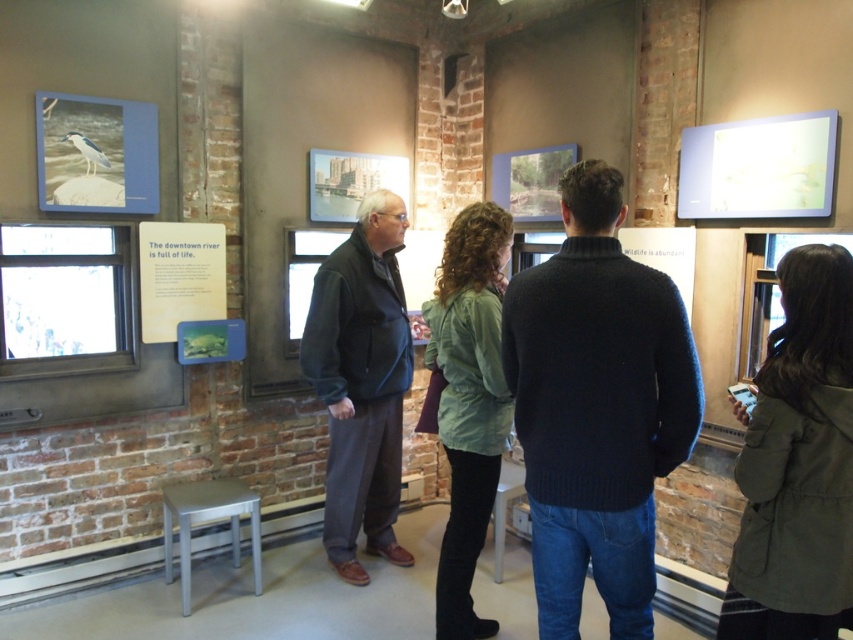
Is the position of green matte jacket at lower right more distant than that of white plastic stool at lower center?

No, green matte jacket at lower right is in front of white plastic stool at lower center.

Can you confirm if green matte jacket at lower right is smaller than white plastic stool at lower center?

Actually, green matte jacket at lower right might be larger than white plastic stool at lower center.

Between point (843, 568) and point (503, 531), which one is positioned behind?

Point (503, 531)

What are the coordinates of `green matte jacket at lower right` in the screenshot? It's located at (798, 464).

Who is higher up, matte paper sign at left or white plastic stool at lower center?

matte paper sign at left is above.

Between matte paper sign at left and white plastic stool at lower center, which one has less height?

With less height is white plastic stool at lower center.

This screenshot has width=853, height=640. Find the location of `matte paper sign at left`. matte paper sign at left is located at coordinates (178, 276).

Locate an element on the screen. The height and width of the screenshot is (640, 853). matte paper sign at left is located at coordinates (178, 276).

Who is taller, green matte jacket at lower right or silver metallic stool at lower left?

green matte jacket at lower right is taller.

Between green matte jacket at lower right and silver metallic stool at lower left, which one is positioned higher?

green matte jacket at lower right is above.

The height and width of the screenshot is (640, 853). What do you see at coordinates (798, 464) in the screenshot? I see `green matte jacket at lower right` at bounding box center [798, 464].

Image resolution: width=853 pixels, height=640 pixels. Identify the location of green matte jacket at lower right. (798, 464).